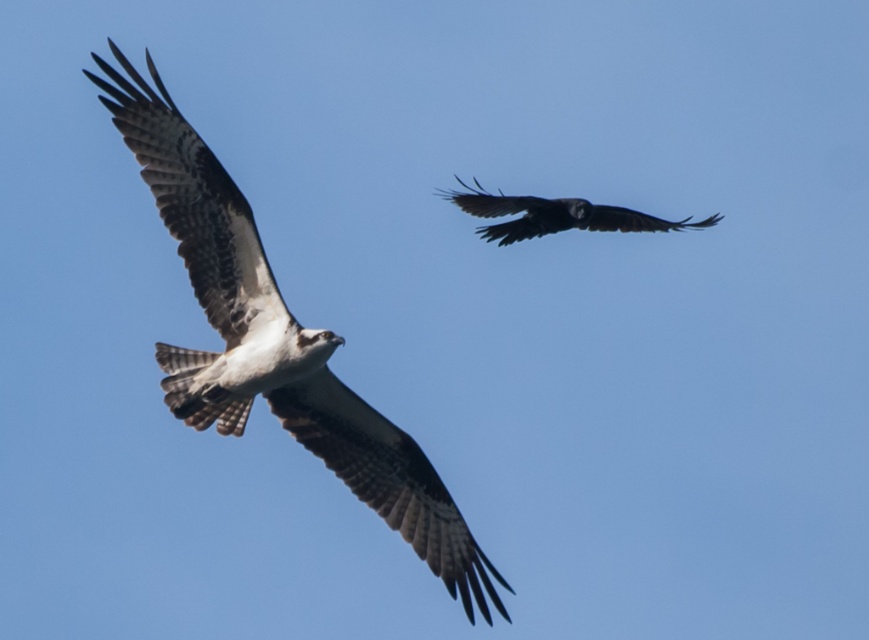
You are a birdwatcher observing the two birds in the sky. You notice the brown speckled feathers at center and the dark glossy raven at upper center. Which bird has a smaller size?

The brown speckled feathers at center is smaller than the dark glossy raven at upper center, so the brown speckled feathers at center is the smaller bird.

Looking at the scene with the clear blue sky, you notice two birds flying. You see the brown speckled feathers at center and the dark glossy raven at upper center. Which of these two objects is positioned to the left of the other?

The brown speckled feathers at center are to the left of the dark glossy raven at upper center.

You are a birdwatcher trying to identify which bird is closer to you. You see the brown speckled feathers at center and the dark glossy raven at upper center. Which bird is nearer to your position?

The brown speckled feathers at center is closer to the viewer than the dark glossy raven at upper center, so the brown speckled feathers at center is nearer to your position.